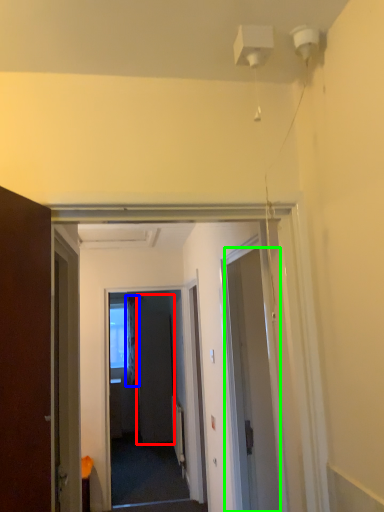
Question: Estimate the real-world distances between objects in this image. Which object is farther from screen door (highlighted by a red box), curtain (highlighted by a blue box) or door (highlighted by a green box)?

Choices:
 (A) curtain
 (B) door

Answer: (B)